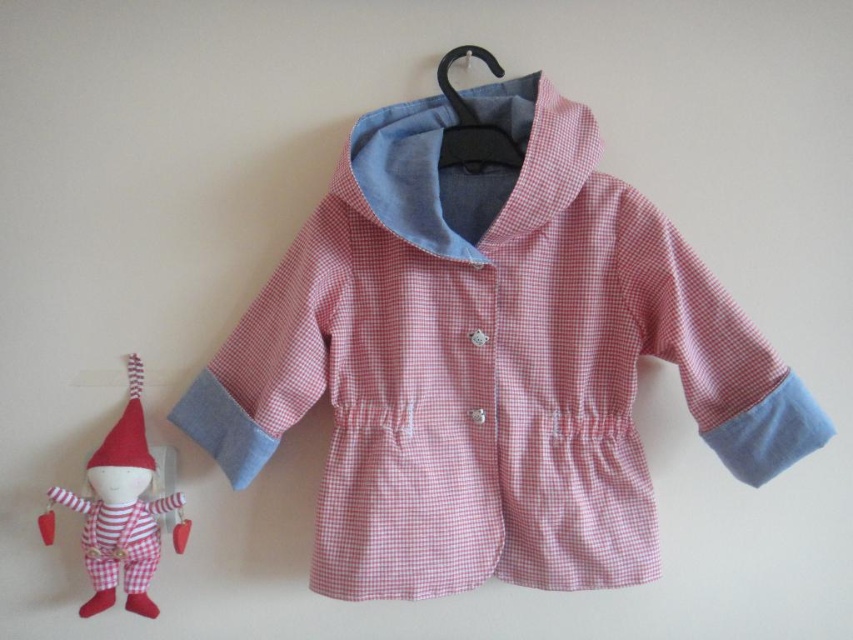
You are trying to hang the pink gingham fabric coat at center on the black plastic hanger at upper center. Based on the description, do you think the hanger can support the width of the coat?

The pink gingham fabric coat at center might be wider than the black plastic hanger at upper center, so there is a possibility that the hanger may not be wide enough to support the coat properly.

You are a child trying to reach both the pink gingham fabric coat at center and the red felt christmas hat at left. Which item is located higher up?

The pink gingham fabric coat at center is above the red felt christmas hat at left, so the coat is higher up.

What is the object located at the coordinates point (120, 509)?

The object at point (120, 509) is the red fabric elf at left.